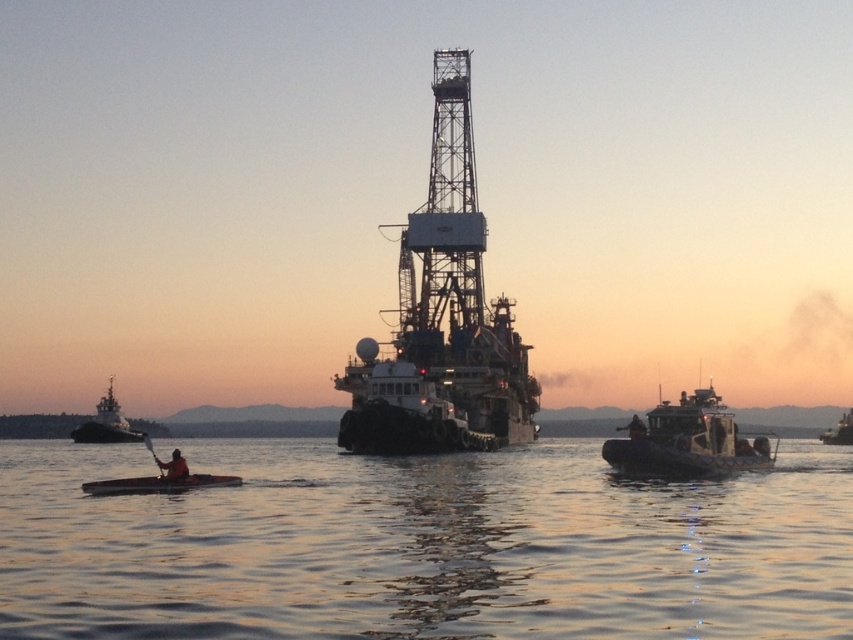
Where is `metallic industrial ship at center`? metallic industrial ship at center is located at coordinates (442, 316).

This screenshot has width=853, height=640. Describe the element at coordinates (442, 316) in the screenshot. I see `metallic industrial ship at center` at that location.

I want to click on metallic industrial ship at center, so click(x=442, y=316).

How distant is smooth wood canoe at lower left from dark brown wooden paddle at lower left?

4.51 meters

Can you confirm if smooth wood canoe at lower left is taller than dark brown wooden paddle at lower left?

Correct, smooth wood canoe at lower left is much taller as dark brown wooden paddle at lower left.

Locate an element on the screen. smooth wood canoe at lower left is located at coordinates (158, 483).

You are a GUI agent. You are given a task and a screenshot of the screen. Output one action in this format:
    pyautogui.click(x=<x>, y=<y>)
    Task: Click on the smooth wood canoe at lower left
    
    Given the screenshot: What is the action you would take?
    pyautogui.click(x=158, y=483)

Between metallic industrial ship at center and dark blue fabric jacket at right, which one is positioned lower?

Positioned lower is dark blue fabric jacket at right.

Is metallic industrial ship at center above dark blue fabric jacket at right?

Yes, metallic industrial ship at center is above dark blue fabric jacket at right.

This screenshot has width=853, height=640. I want to click on metallic industrial ship at center, so click(442, 316).

Where is `metallic industrial ship at center`? Image resolution: width=853 pixels, height=640 pixels. metallic industrial ship at center is located at coordinates (442, 316).